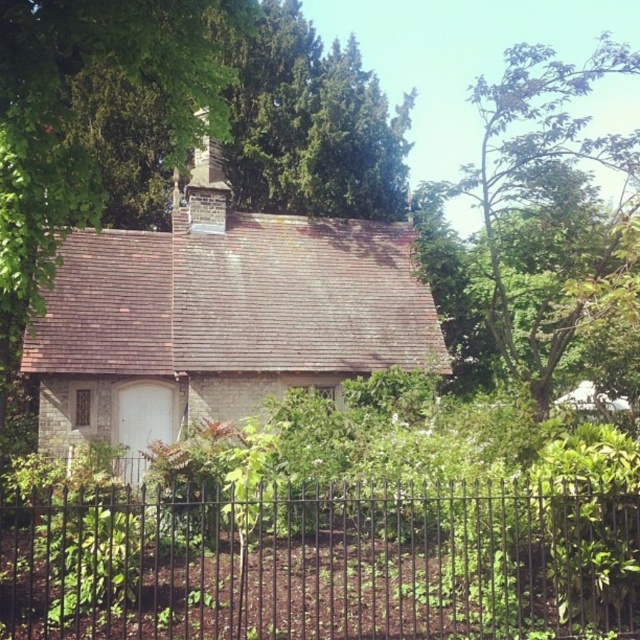
Question: Is brick cottage at center in front of brick chimney at center?

Choices:
 (A) yes
 (B) no

Answer: (A)

Question: Is black wrought iron fence at lower center above green leafy tree at upper right?

Choices:
 (A) yes
 (B) no

Answer: (B)

Question: From the image, what is the correct spatial relationship of black wrought iron fence at lower center in relation to green leafy tree at upper right?

Choices:
 (A) left
 (B) right

Answer: (A)

Question: Which object is closer to the camera taking this photo?

Choices:
 (A) brick cottage at center
 (B) green leafy tree at upper right

Answer: (B)

Question: Estimate the real-world distances between objects in this image. Which object is farther from the black wrought iron fence at lower center?

Choices:
 (A) brick chimney at center
 (B) brick cottage at center
 (C) green leafy tree at upper right

Answer: (C)

Question: Which point is farther to the camera?

Choices:
 (A) black wrought iron fence at lower center
 (B) brick chimney at center
 (C) brick cottage at center

Answer: (B)